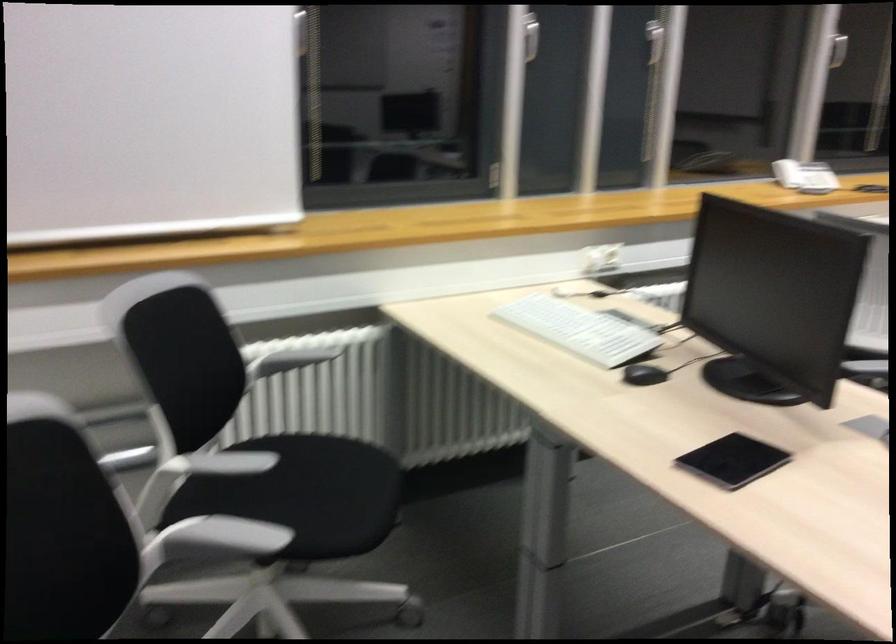
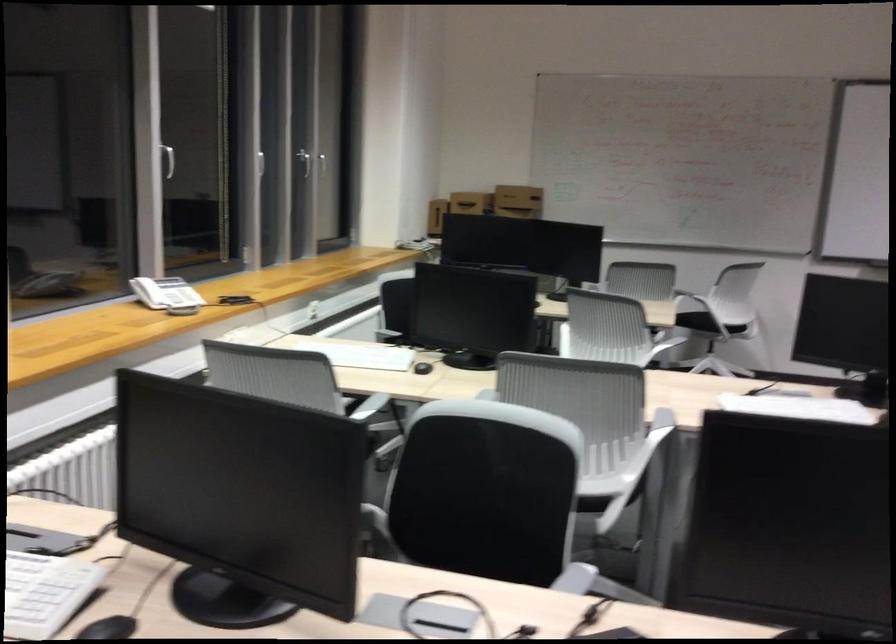
Question: Based on the continuous images, in which direction is the camera rotating? Reply with the corresponding letter.

Choices:
 (A) Left
 (B) Right
 (C) Up
 (D) Down

Answer: (B)